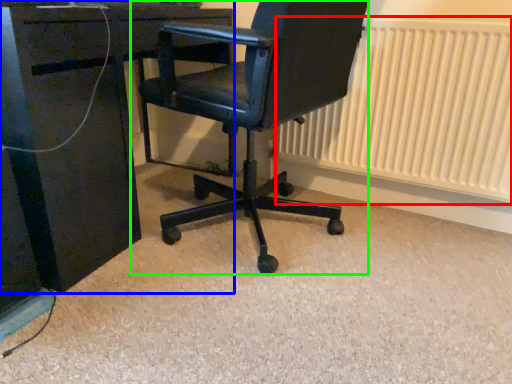
Question: Which object is the farthest from radiator (highlighted by a red box)? Choose among these: desk (highlighted by a blue box) or chair (highlighted by a green box).

Choices:
 (A) desk
 (B) chair

Answer: (A)